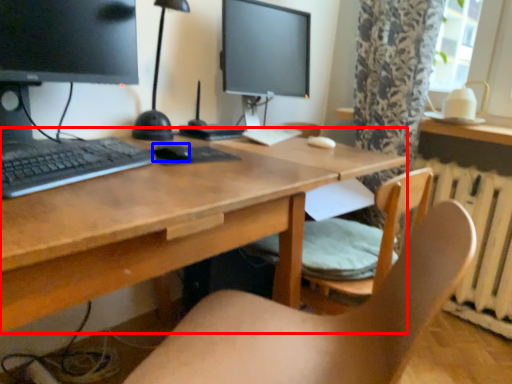
Question: Which of the following is the closest to the observer, desk (highlighted by a red box) or mouse (highlighted by a blue box)?

Choices:
 (A) desk
 (B) mouse

Answer: (A)